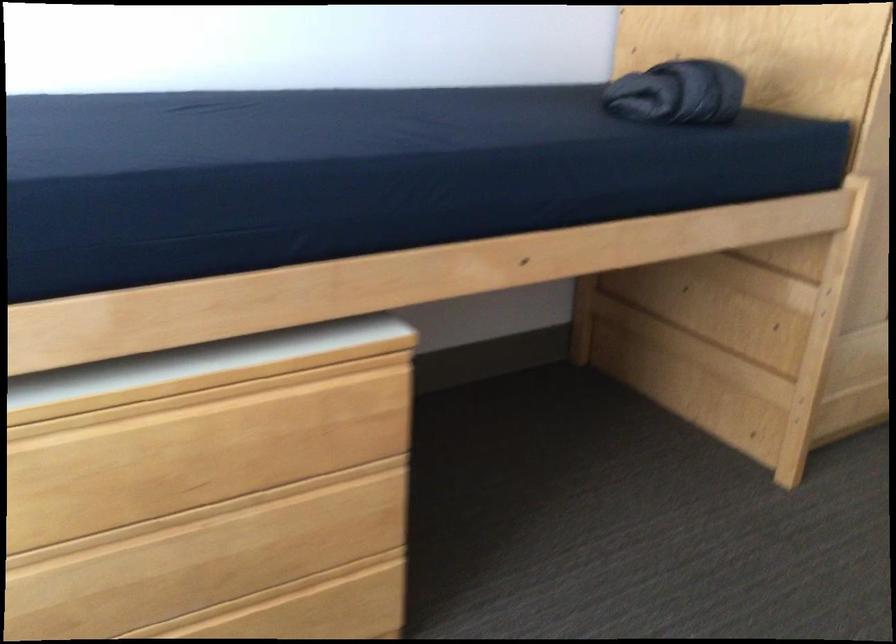
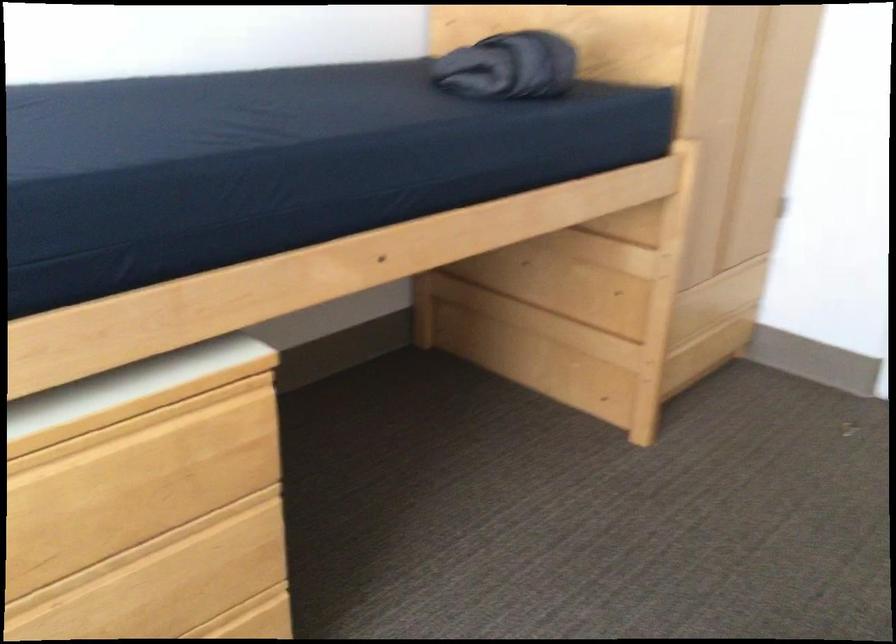
Find the pixel in the second image that matches point (291, 368) in the first image.

(133, 413)